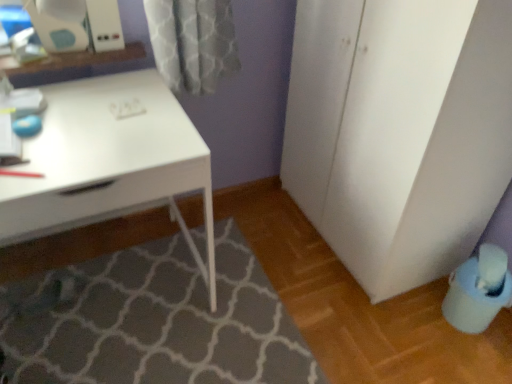
I want to click on free space in front of blue plastic swivel chair at lower right, so click(474, 359).